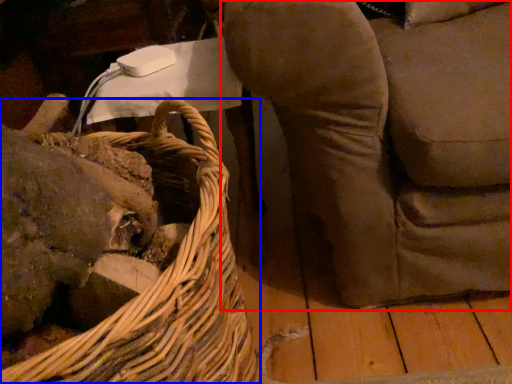
Question: Among these objects, which one is nearest to the camera, furniture (highlighted by a red box) or picnic basket (highlighted by a blue box)?

Choices:
 (A) furniture
 (B) picnic basket

Answer: (B)